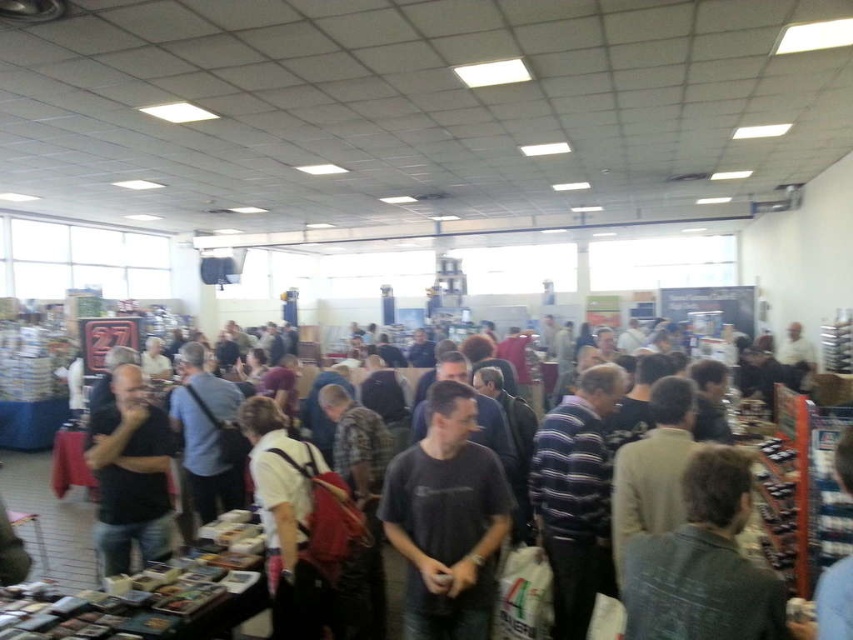
Can you confirm if dark gray t-shirt at center is thinner than black matte shirt at left?

No, dark gray t-shirt at center is not thinner than black matte shirt at left.

Is point (419, 544) farther from viewer compared to point (126, 483)?

No, (419, 544) is in front of (126, 483).

I want to click on dark gray t-shirt at center, so click(447, 520).